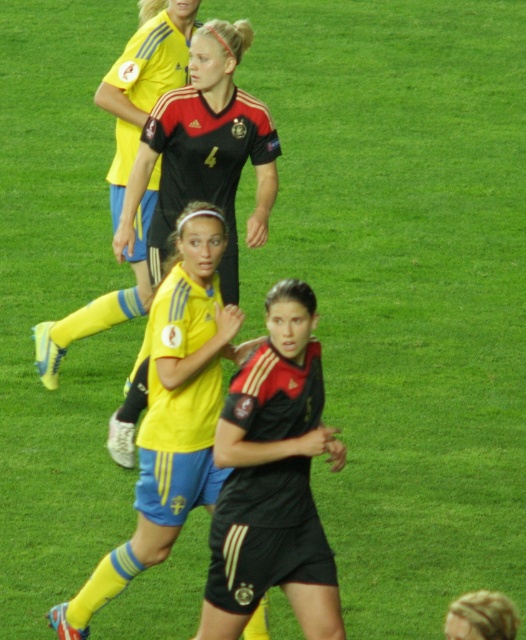
Based on the photo, you are a soccer referee observing the match. You need to identify which player is closer to the ball based on their jersey sizes. Since the yellow matte jersey at center is larger than the black matte jersey at upper center, which player is closer to the ball?

The yellow matte jersey at center is larger in size than the black matte jersey at upper center, so the player wearing the yellow matte jersey at center is closer to the ball.

You are a soccer player positioned at point (157, 10) and want to pass the ball to your teammate at point (171, 444). Considering the current positions of the players, will your pass go through an open path without being intercepted?

Point (171, 444) is in front of point (157, 10), so the pass will go through an open path without being intercepted.

You are a soccer referee observing the game. You notice the yellow matte jersey at center and the black matte jersey at upper center. Which player is closer to you, the referee?

The yellow matte jersey at center is closer to you because it is in front of the black matte jersey at upper center.